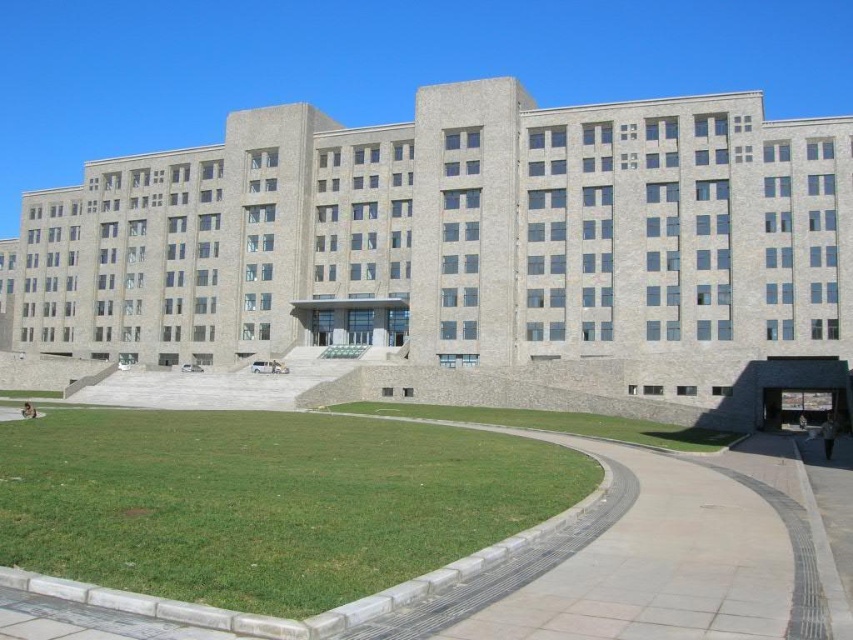
You are standing at the entrance of the building and want to walk towards the green grass at lower center. Which direction should you go to avoid stepping on the green grass at lower left?

To reach the green grass at lower center while avoiding the green grass at lower left, you should walk towards the right side of the pathway, as the green grass at lower left is located in front of the green grass at lower center and would be on your left side as you approach.

You are standing at the entrance of the building and want to walk to the point marked as point (161, 536). Which direction should you go compared to the point (531, 420)?

Since point (161, 536) is closer to the viewer than point (531, 420), you should walk towards the direction of point (161, 536), which is closer to you compared to point (531, 420).